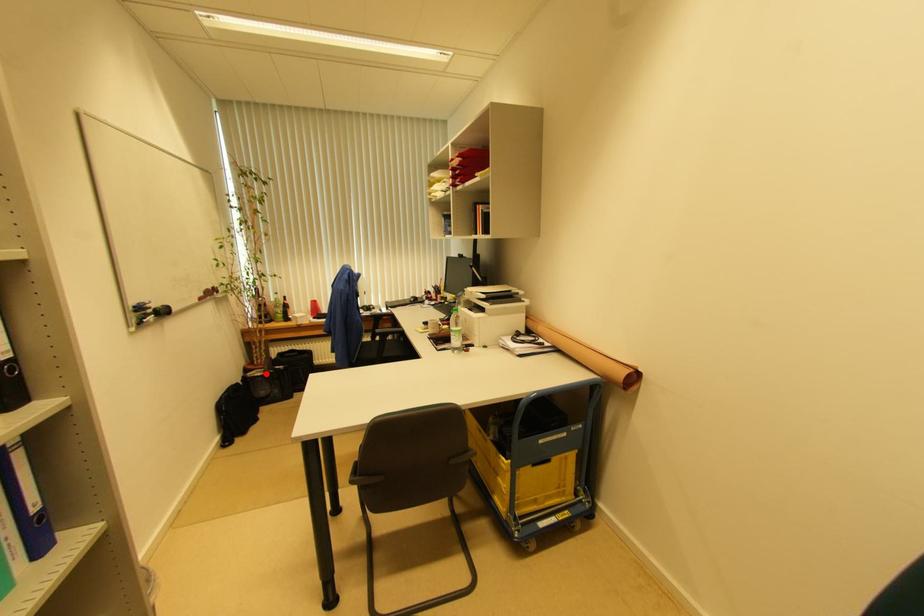
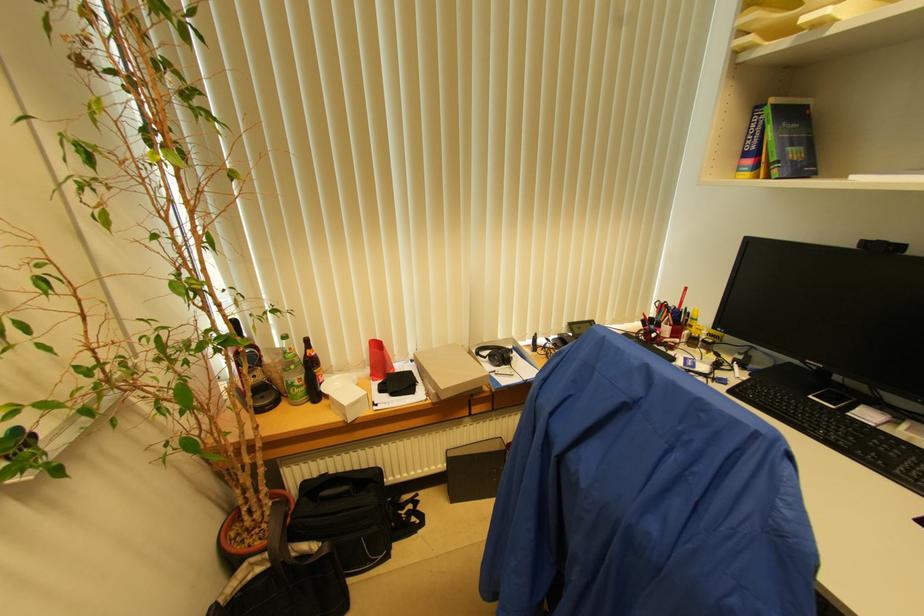
The point at the highlighted location is marked in the first image. Where is the corresponding point in the second image?

(273, 561)